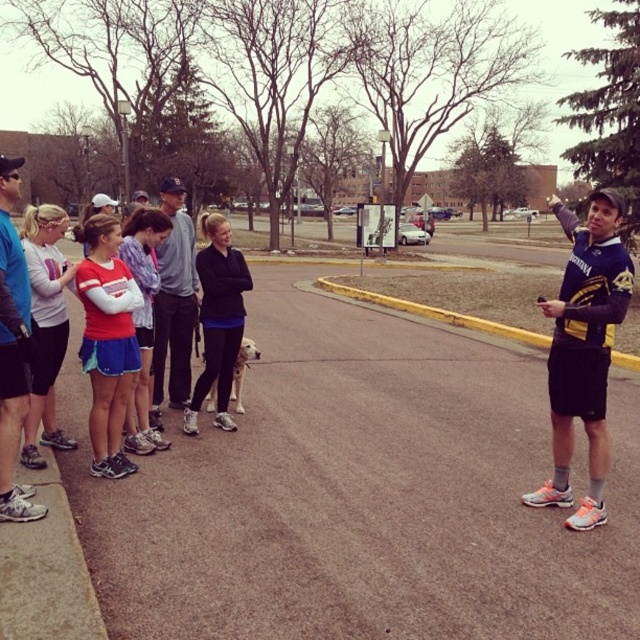
You are a photographer trying to capture a group photo of the blue fabric shirt at left and the dark gray sweatshirt at center. Which clothing item should you zoom in on to ensure both are equally visible in the photo?

The blue fabric shirt at left has a lesser width compared to dark gray sweatshirt at center, so you should zoom in on the dark gray sweatshirt at center to ensure both are equally visible in the photo.

You are a photographer trying to capture a group photo of the blue fabric shirt at left and the dark gray sweatshirt at center. Which one should you focus on first if you want to ensure both are in the frame without moving the camera?

The blue fabric shirt at left is not as tall as the dark gray sweatshirt at center, so you should focus on the dark gray sweatshirt at center first to ensure it fits within the frame.